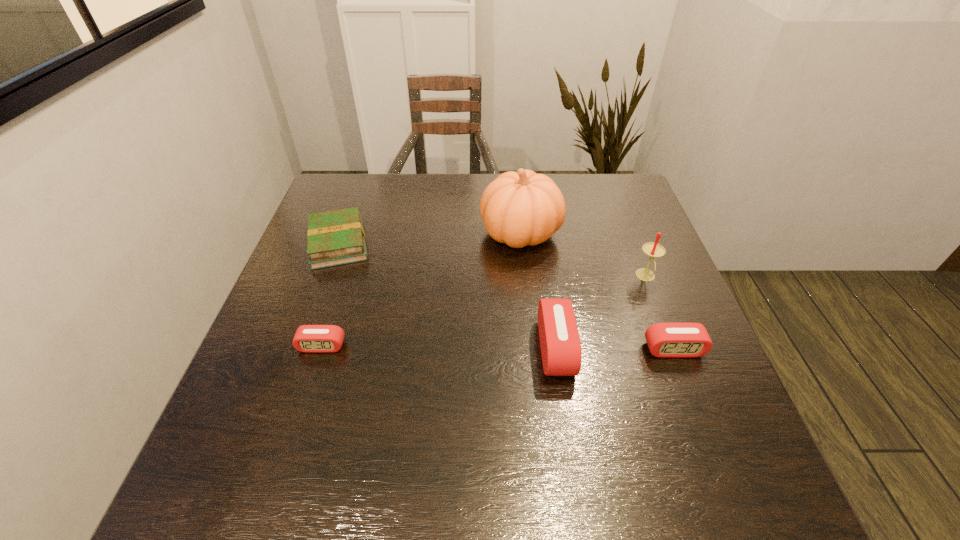
Where is `free space for an extra alarm_clock to achieve even spacing`? This screenshot has height=540, width=960. free space for an extra alarm_clock to achieve even spacing is located at coordinates (439, 347).